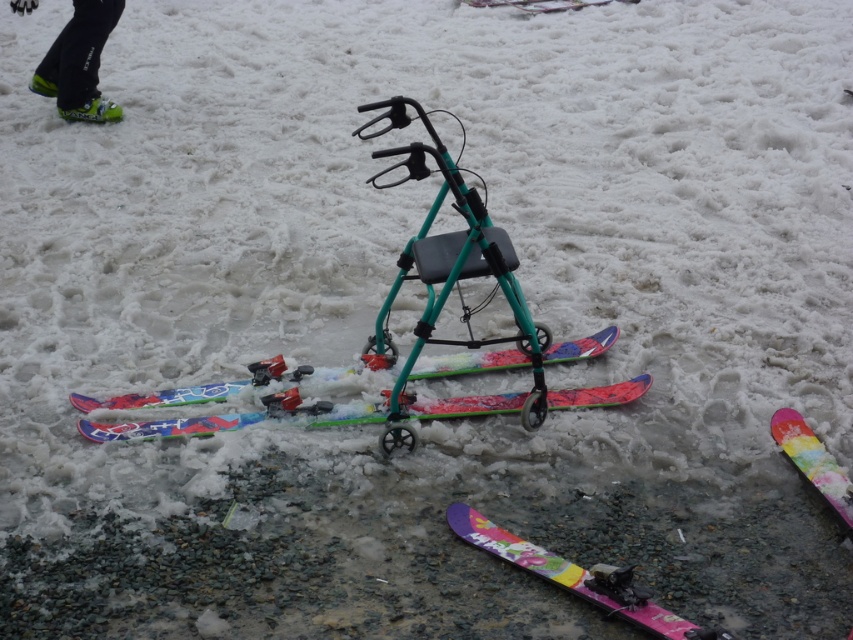
You are a delivery person who needs to place a package between the shiny pink plastic ski at lower right and the multicolored plastic ski at center. The package requires a minimum of 1 meter of space to be placed safely. Based on the scene, is there enough space between them?

The shiny pink plastic ski at lower right and multicolored plastic ski at center are 76.86 centimeters apart from each other. Since 76.86 cm is less than 1 meter, there is not enough space to place the package safely between them.

You need to choose between the multicolored plastic skis at center and the multicolored plastic ski at center to carry the mobility walker. Which one is larger and can hold more weight?

The multicolored plastic skis at center is bigger than multicolored plastic ski at center, so it can hold more weight.